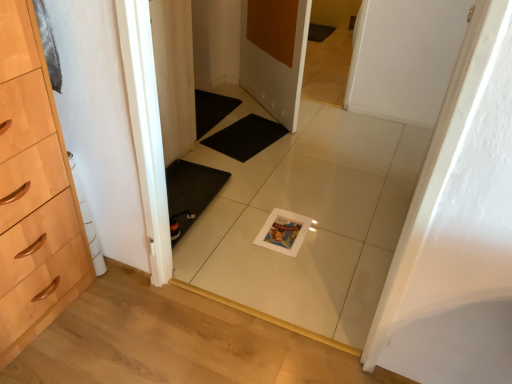
Where is `white glossy tile at center`? This screenshot has width=512, height=384. white glossy tile at center is located at coordinates (311, 217).

Locate an element on the screen. black rubber bath mat at center is located at coordinates (246, 137).

At what (x,y) coordinates should I click in order to perform the action: click on white glossy tile at center. Please return your answer as a coordinate pair (x, y). The height and width of the screenshot is (384, 512). Looking at the image, I should click on (311, 217).

Considering the positions of objects white glossy tile at center and black rubber bath mat at center in the image provided, who is in front, white glossy tile at center or black rubber bath mat at center?

white glossy tile at center is in front.

In the scene shown: From the image's perspective, is white glossy tile at center beneath black rubber bath mat at center?

Yes.

Consider the image. Is white glossy tile at center thinner than black rubber bath mat at center?

Correct, the width of white glossy tile at center is less than that of black rubber bath mat at center.

From a real-world perspective, is white glossy tile at center physically located above or below black rubber bath mat at center?

white glossy tile at center is situated higher than black rubber bath mat at center in the real world.

From a real-world perspective, is white matte door at center, the 2th door when ordered from back to front, physically located above or below black rubber bath mat at center?

white matte door at center, the 2th door when ordered from back to front, is above black rubber bath mat at center.

Based on the photo, which of these two, white matte door at center, arranged as the 1th door when viewed from the front, or black rubber bath mat at center, is wider?

Wider between the two is black rubber bath mat at center.

Considering the sizes of objects white matte door at center, arranged as the 1th door when viewed from the front, and black rubber bath mat at center in the image provided, who is smaller, white matte door at center, arranged as the 1th door when viewed from the front, or black rubber bath mat at center?

With smaller size is black rubber bath mat at center.

How many degrees apart are the facing directions of white matte door at center, the 2th door when ordered from back to front, and black rubber bath mat at center?

white matte door at center, the 2th door when ordered from back to front, and black rubber bath mat at center are facing 171 degrees away from each other.

Can you confirm if black rubber bath mat at center is smaller than white matte door at center, which is counted as the first door, starting from the right?

Indeed, black rubber bath mat at center has a smaller size compared to white matte door at center, which is counted as the first door, starting from the right.

From the image's perspective, who appears lower, black rubber bath mat at center or white matte door at center, which is counted as the first door, starting from the right?

white matte door at center, which is counted as the first door, starting from the right.

Is black rubber bath mat at center not within white matte door at center, which is counted as the first door, starting from the right?

Absolutely, black rubber bath mat at center is external to white matte door at center, which is counted as the first door, starting from the right.

Is white glossy tile at center not close to white matte door at center, which is counted as the first door, starting from the right?

No, there isn't a large distance between white glossy tile at center and white matte door at center, which is counted as the first door, starting from the right.

Is white glossy tile at center looking in the opposite direction of white matte door at center, arranged as the 1th door when viewed from the front?

Yes, white matte door at center, arranged as the 1th door when viewed from the front, is at the back of white glossy tile at center.

At what (x,y) coordinates should I click in order to perform the action: click on tile that is behind the white matte door at center, which is counted as the first door, starting from the right. Please return your answer as a coordinate pair (x, y). The image size is (512, 384). Looking at the image, I should click on (311, 217).

Between white glossy tile at center and white matte door at center, which is counted as the first door, starting from the right, which one has smaller width?

Thinner between the two is white matte door at center, which is counted as the first door, starting from the right.

Is matte white door at center, which is the second door in front-to-back order, at the back of white glossy tile at center?

Absolutely, white glossy tile at center is directed away from matte white door at center, which is the second door in front-to-back order.

How distant is white glossy tile at center from matte white door at center, which is counted as the first door, starting from the back?

white glossy tile at center and matte white door at center, which is counted as the first door, starting from the back, are 28.61 inches apart from each other.

In terms of width, does white glossy tile at center look wider or thinner when compared to matte white door at center, which is counted as the first door, starting from the back?

In the image, white glossy tile at center appears to be more narrow than matte white door at center, which is counted as the first door, starting from the back.

Considering the sizes of white glossy tile at center and matte white door at center, the 2th door from the right, in the image, is white glossy tile at center bigger or smaller than matte white door at center, the 2th door from the right,?

Clearly, white glossy tile at center is larger in size than matte white door at center, the 2th door from the right.

Is white matte door at center, the 2th door when ordered from back to front, facing towards matte white door at center, the 2th door from the right?

No, white matte door at center, the 2th door when ordered from back to front, is not facing towards matte white door at center, the 2th door from the right.

Measure the distance from white matte door at center, arranged as the 1th door when viewed from the front, to matte white door at center, which is counted as the first door, starting from the back.

white matte door at center, arranged as the 1th door when viewed from the front, and matte white door at center, which is counted as the first door, starting from the back, are 6.14 feet apart.

Considering the sizes of objects white matte door at center, the 2th door when ordered from back to front, and matte white door at center, which is counted as the first door, starting from the back, in the image provided, who is shorter, white matte door at center, the 2th door when ordered from back to front, or matte white door at center, which is counted as the first door, starting from the back,?

Standing shorter between the two is matte white door at center, which is counted as the first door, starting from the back.

Considering their positions, is matte white door at center, which is counted as the first door, starting from the left, located in front of or behind white matte door at center, the 2th door from the left?

matte white door at center, which is counted as the first door, starting from the left, is behind white matte door at center, the 2th door from the left.

Is matte white door at center, which is the second door in front-to-back order, aimed at white matte door at center, which is counted as the first door, starting from the right?

No, matte white door at center, which is the second door in front-to-back order, does not turn towards white matte door at center, which is counted as the first door, starting from the right.

Is matte white door at center, which is the second door in front-to-back order, outside of white matte door at center, arranged as the 1th door when viewed from the front?

Yes, matte white door at center, which is the second door in front-to-back order, is located beyond the bounds of white matte door at center, arranged as the 1th door when viewed from the front.

Identify the location of tile on the right of black rubber bath mat at center. The image size is (512, 384). (311, 217).

Where is `door that is the 2nd one above the black rubber bath mat at center (from a real-world perspective)`? Image resolution: width=512 pixels, height=384 pixels. door that is the 2nd one above the black rubber bath mat at center (from a real-world perspective) is located at coordinates (458, 229).

Looking at this image, from the image, which object appears to be farther from black rubber bath mat at center, white glossy tile at center or white matte door at center, which is counted as the first door, starting from the right?

Among the two, white matte door at center, which is counted as the first door, starting from the right, is located further to black rubber bath mat at center.

Based on their spatial positions, is white matte door at center, which is counted as the first door, starting from the right, or white glossy tile at center closer to black rubber bath mat at center?

Based on the image, white glossy tile at center appears to be nearer to black rubber bath mat at center.

Consider the image. Estimate the real-world distances between objects in this image. Which object is further from white glossy tile at center, white matte door at center, which is counted as the first door, starting from the right, or matte white door at center, which is the second door in front-to-back order?

Based on the image, white matte door at center, which is counted as the first door, starting from the right, appears to be further to white glossy tile at center.

Looking at the image, which one is located closer to white matte door at center, which is counted as the first door, starting from the right, white glossy tile at center or matte white door at center, which is counted as the first door, starting from the left?

Among the two, white glossy tile at center is located nearer to white matte door at center, which is counted as the first door, starting from the right.

Based on their spatial positions, is black rubber bath mat at center or matte white door at center, which is counted as the first door, starting from the back, closer to white matte door at center, which is counted as the first door, starting from the right?

Among the two, black rubber bath mat at center is located nearer to white matte door at center, which is counted as the first door, starting from the right.

Based on the photo, when comparing their distances from black rubber bath mat at center, does white glossy tile at center or matte white door at center, which is counted as the first door, starting from the back, seem further?

white glossy tile at center.

From the image, which object appears to be farther from black rubber bath mat at center, matte white door at center, which is counted as the first door, starting from the left, or white glossy tile at center?

Based on the image, white glossy tile at center appears to be further to black rubber bath mat at center.

From the image, which object appears to be nearer to white glossy tile at center, black rubber bath mat at center or matte white door at center, which is counted as the first door, starting from the left?

Based on the image, black rubber bath mat at center appears to be nearer to white glossy tile at center.

The width and height of the screenshot is (512, 384). I want to click on tile between white matte door at center, the 2th door when ordered from back to front, and matte white door at center, which is counted as the first door, starting from the left, from front to back, so click(311, 217).

Identify the location of door between white glossy tile at center and black rubber bath mat at center along the z-axis. This screenshot has width=512, height=384. (274, 54).

The height and width of the screenshot is (384, 512). I want to click on tile between white matte door at center, arranged as the 1th door when viewed from the front, and black rubber bath mat at center in the front-back direction, so click(311, 217).

Find the location of a particular element. This screenshot has width=512, height=384. door between white matte door at center, arranged as the 1th door when viewed from the front, and black rubber bath mat at center from front to back is located at coordinates (274, 54).